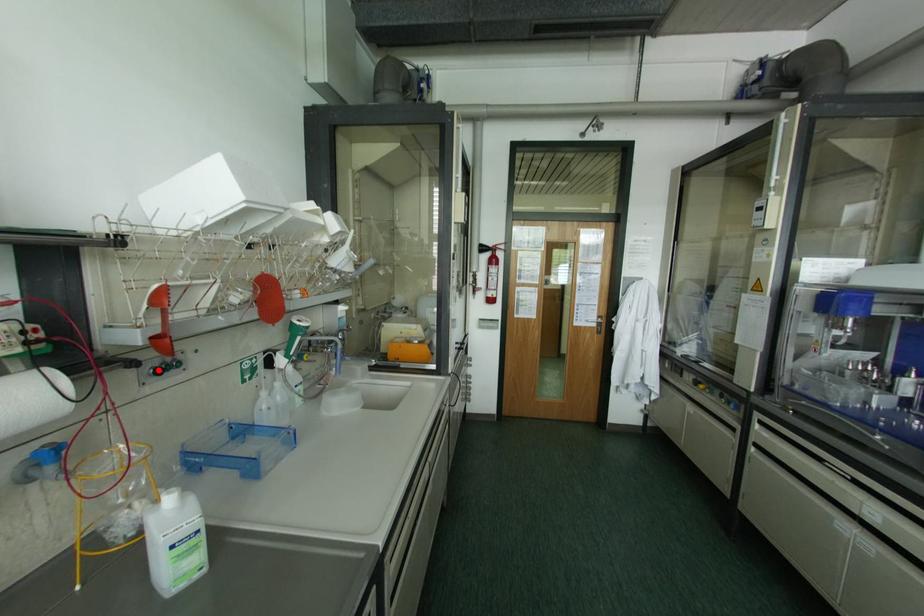
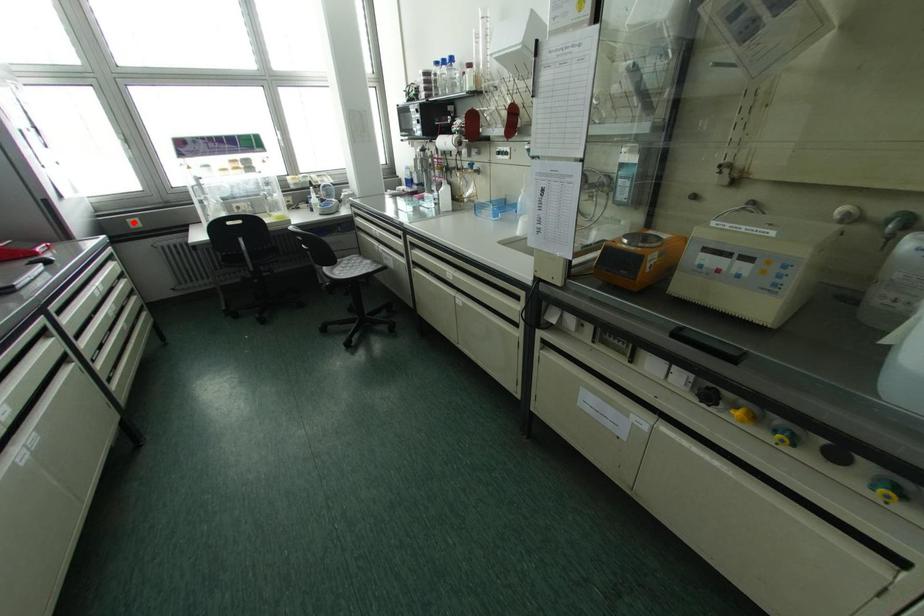
I am providing you with two images of the same scene from different viewpoints. A red point is marked on the first image and another point is marked on the second image. Is the red point in image1 aligned with the point shown in image2?

No